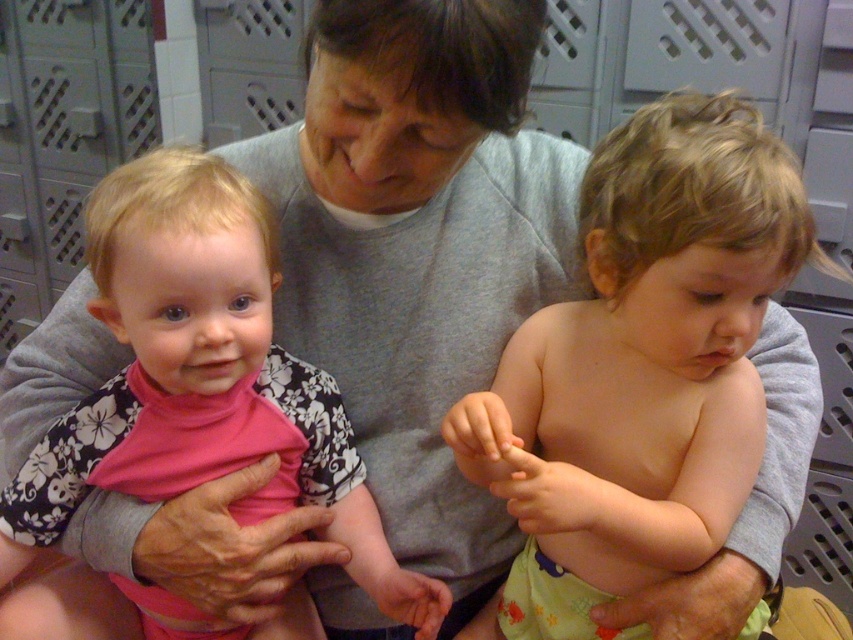
Who is lower down, smooth skin toddler at center or pink fabric toddler at left?

smooth skin toddler at center

Between smooth skin toddler at center and pink fabric toddler at left, which one is positioned higher?

pink fabric toddler at left is above.

Between point (674, 205) and point (248, 372), which one is positioned behind?

The point (248, 372) is behind.

What are the coordinates of `smooth skin toddler at center` in the screenshot? It's located at (647, 352).